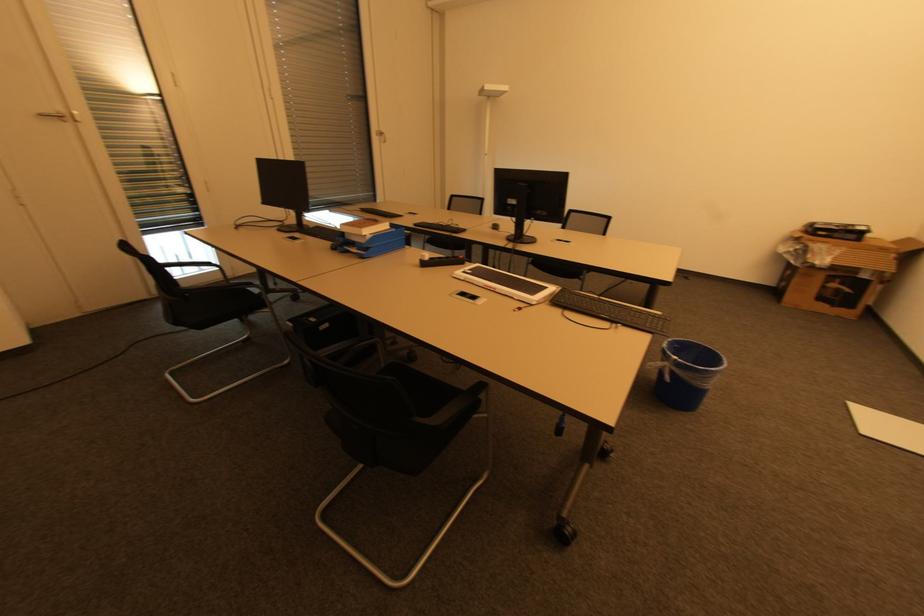
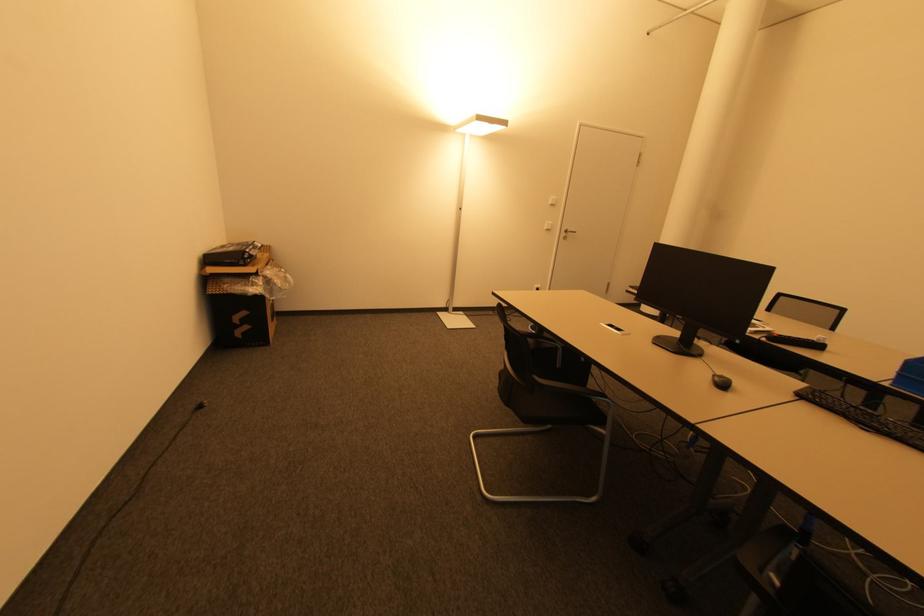
The point at (x=687, y=278) is marked in the first image. Where is the corresponding point in the second image?

(201, 408)